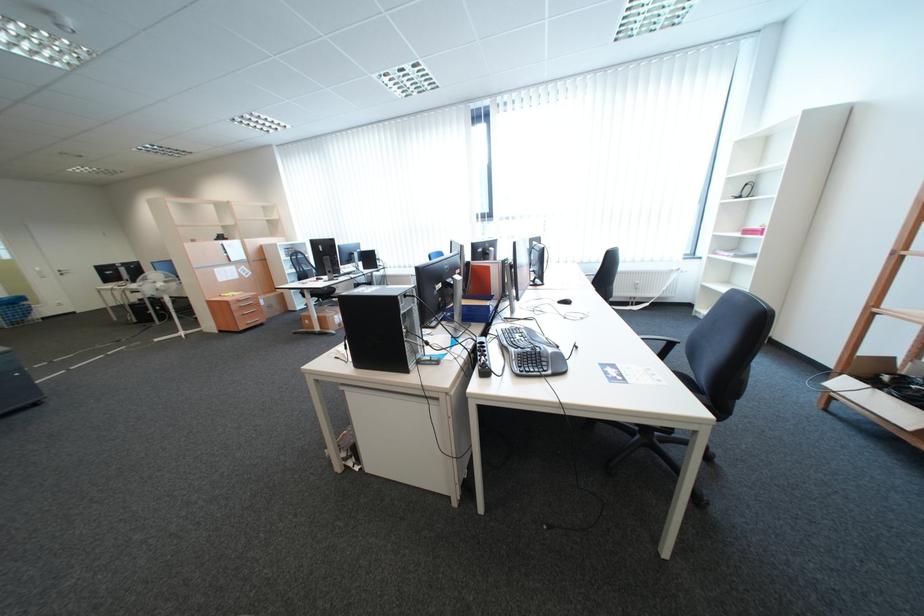
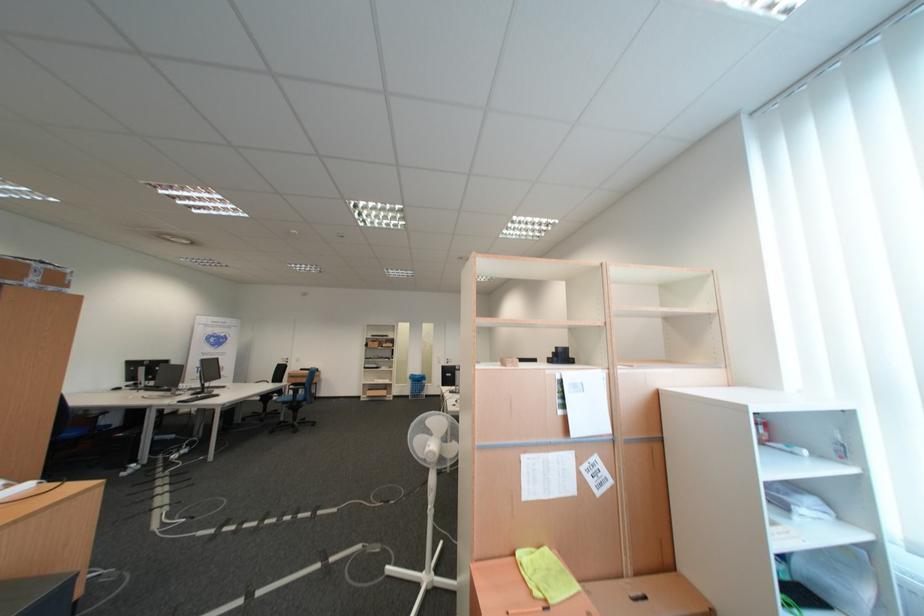
Locate, in the second image, the point that corresponds to (x=195, y=334) in the first image.

(439, 578)